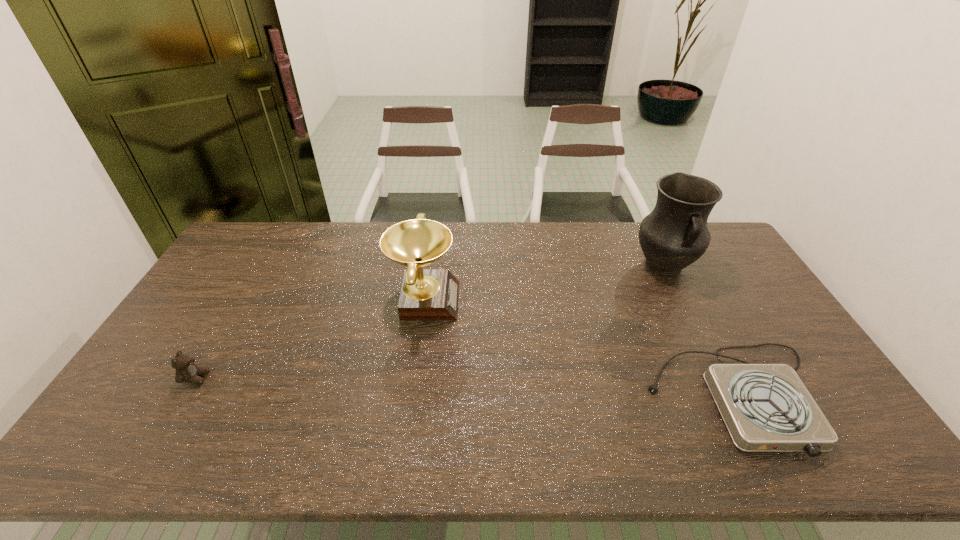
The image size is (960, 540). Identify the location of free space between the second object from left to right and the pitcher. (544, 283).

You are a GUI agent. You are given a task and a screenshot of the screen. Output one action in this format:
    pyautogui.click(x=<x>, y=<y>)
    Task: Click on the object that is the third nearest to the tallest object
    
    Given the screenshot: What is the action you would take?
    pyautogui.click(x=186, y=371)

You are a GUI agent. You are given a task and a screenshot of the screen. Output one action in this format:
    pyautogui.click(x=<x>, y=<y>)
    Task: Click on the object that is the second closest to the pitcher
    The height and width of the screenshot is (540, 960).
    Given the screenshot: What is the action you would take?
    pyautogui.click(x=427, y=294)

Find the location of a particular element. free space that satisfies the following two spatial constraints: 1. on the handle side of the tallest object; 2. on the front-facing side of the third object from right to left is located at coordinates (681, 299).

Where is `free location that satisfies the following two spatial constraints: 1. on the handle side of the pitcher; 2. on the face of the teddy bear`? Image resolution: width=960 pixels, height=540 pixels. free location that satisfies the following two spatial constraints: 1. on the handle side of the pitcher; 2. on the face of the teddy bear is located at coordinates (719, 378).

Locate an element on the screen. vacant space that satisfies the following two spatial constraints: 1. on the handle side of the tallest object; 2. on the front-facing side of the third object from right to left is located at coordinates (681, 299).

This screenshot has width=960, height=540. In order to click on vacant region that satisfies the following two spatial constraints: 1. on the handle side of the tallest object; 2. on the face of the leftmost object in this screenshot , I will do `click(719, 378)`.

Locate an element on the screen. free space that satisfies the following two spatial constraints: 1. on the handle side of the pitcher; 2. on the face of the teddy bear is located at coordinates 719,378.

Find the location of a particular element. This screenshot has width=960, height=540. free spot that satisfies the following two spatial constraints: 1. on the handle side of the tallest object; 2. on the face of the leftmost object is located at coordinates (719, 378).

Where is `vacant area in the image that satisfies the following two spatial constraints: 1. on the handle side of the pitcher; 2. on the front-facing side of the second object from left to right`? The image size is (960, 540). vacant area in the image that satisfies the following two spatial constraints: 1. on the handle side of the pitcher; 2. on the front-facing side of the second object from left to right is located at coordinates click(x=681, y=299).